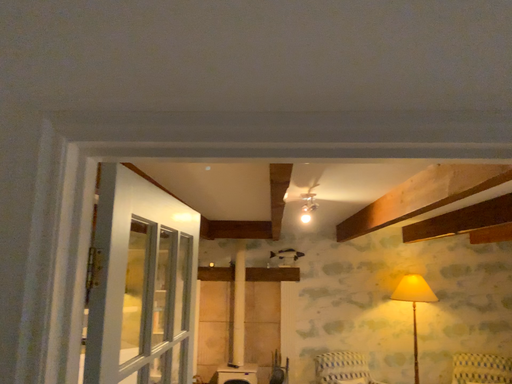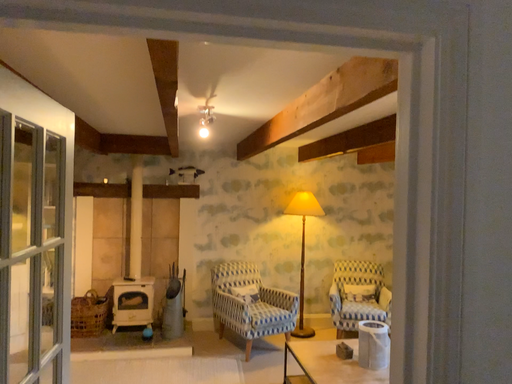
Question: Which way did the camera rotate in the video?

Choices:
 (A) rotated upward
 (B) rotated downward

Answer: (B)